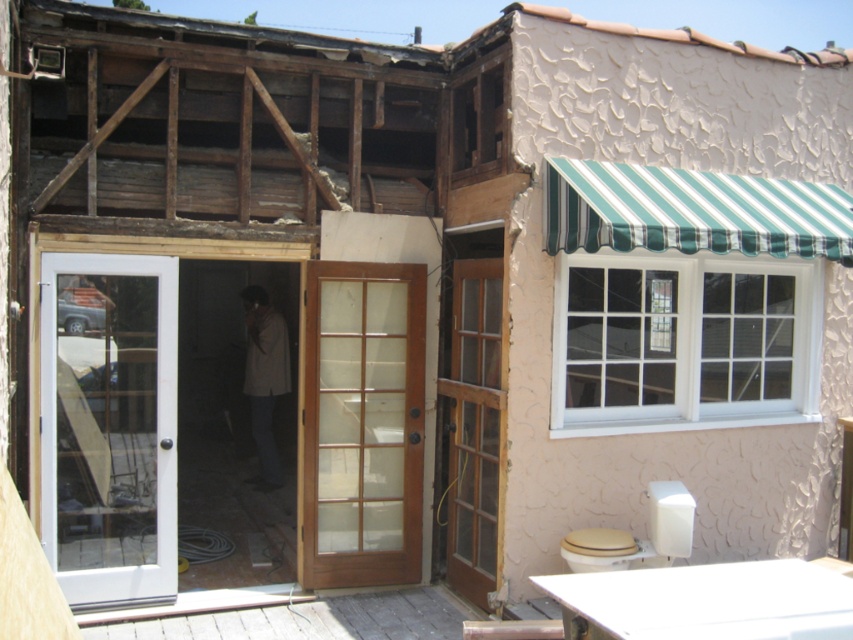
You are standing at the entrance of the partially renovated building and want to reach the light brown fabric jacket at center. The white glass door at left is in your way. Can you walk around it to get to the jacket?

The white glass door at left is 3.06 meters away from the light brown fabric jacket at center, so you can walk around the white glass door at left to reach the jacket since it is not too close to the jacket.

You are standing at the entrance of the building and want to locate the white glass door at left. According to the coordinates provided, where should you look to find it?

The white glass door at left is located at coordinates point 0.667 on the x axis and 0.128 on the y axis.

You are standing at the entrance of the building and want to locate the mahogany wood french door at center. Based on its 2D coordinates, in which direction should you move relative to your current position to reach it?

The mahogany wood french door at center is located at coordinates point (363, 422), so you should move towards the right and slightly forward to reach it.